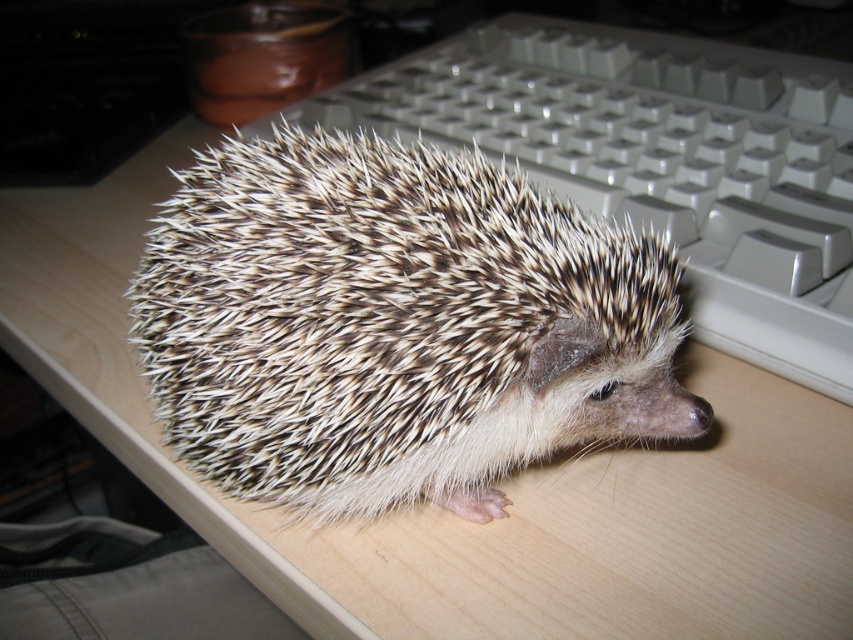
Question: Does spiky brown hedgehog at center appear on the left side of white plastic keyboard at upper right?

Choices:
 (A) yes
 (B) no

Answer: (A)

Question: Observing the image, what is the correct spatial positioning of spiky brown hedgehog at center in reference to white plastic keyboard at upper right?

Choices:
 (A) above
 (B) below

Answer: (B)

Question: Among these points, which one is farthest from the camera?

Choices:
 (A) (502, 317)
 (B) (761, 266)

Answer: (B)

Question: Can you confirm if spiky brown hedgehog at center is positioned to the left of white plastic keyboard at upper right?

Choices:
 (A) no
 (B) yes

Answer: (B)

Question: Which point is farther from the camera taking this photo?

Choices:
 (A) (404, 358)
 (B) (509, 88)

Answer: (B)